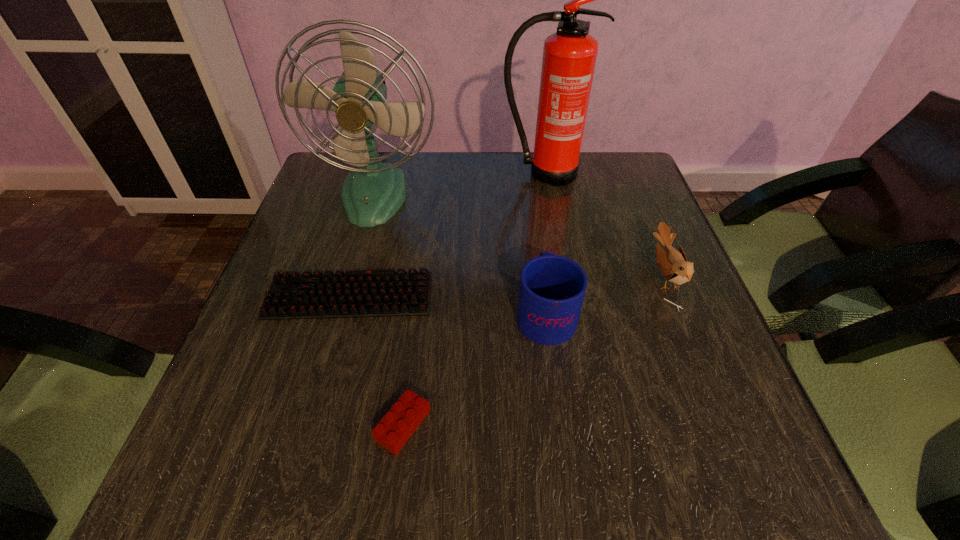
At what (x,y) coordinates should I click in order to perform the action: click on free space between the mug and the fourth tallest object. Please return your answer as a coordinate pair (x, y). This screenshot has height=540, width=960. Looking at the image, I should click on (605, 294).

Point out which object is positioned as the fourth nearest to the third shortest object. Please provide its 2D coordinates. Your answer should be formatted as a tuple, i.e. [(x, y)], where the tuple contains the x and y coordinates of a point satisfying the conditions above.

[(371, 194)]

You are a GUI agent. You are given a task and a screenshot of the screen. Output one action in this format:
    pyautogui.click(x=<x>, y=<y>)
    Task: Click on the object that is the fifth closest one to the bird
    
    Given the screenshot: What is the action you would take?
    [x=396, y=427]